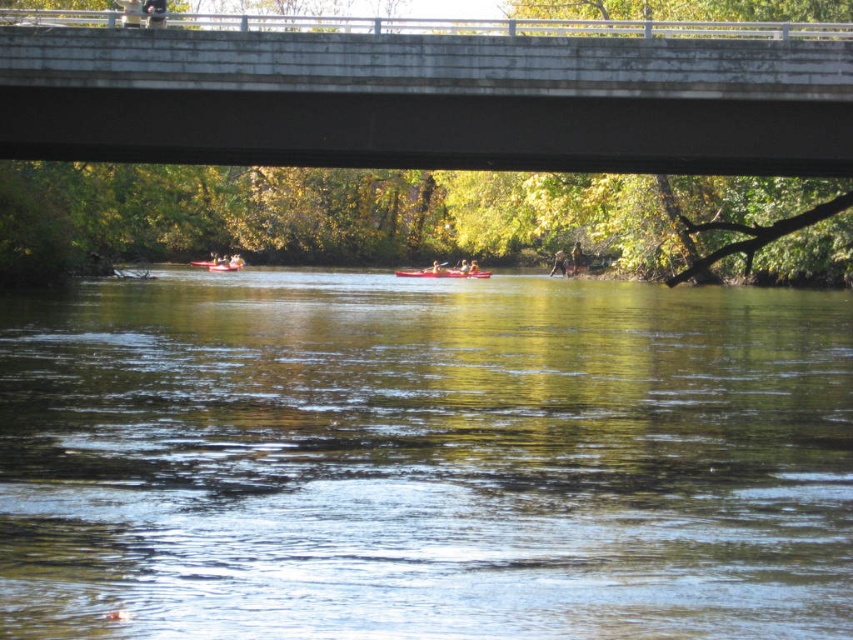
Question: Does matte red kayak at center have a smaller size compared to brown leather jacket at center?

Choices:
 (A) yes
 (B) no

Answer: (A)

Question: Is matte red kayak at center further to the viewer compared to brown leather jacket at center?

Choices:
 (A) yes
 (B) no

Answer: (B)

Question: From the image, what is the correct spatial relationship of green reflective water at center in relation to concrete bridge at upper center?

Choices:
 (A) below
 (B) above

Answer: (A)

Question: Among these objects, which one is nearest to the camera?

Choices:
 (A) green reflective water at center
 (B) matte red kayak at center
 (C) brown leather jacket at center
 (D) concrete bridge at upper center

Answer: (A)

Question: Which of the following is the closest to the observer?

Choices:
 (A) matte red kayak at center
 (B) brown leather jacket at center
 (C) concrete bridge at upper center
 (D) green reflective water at center

Answer: (D)

Question: Which point is closer to the camera taking this photo?

Choices:
 (A) (561, 275)
 (B) (364, 346)
 (C) (219, 266)

Answer: (B)